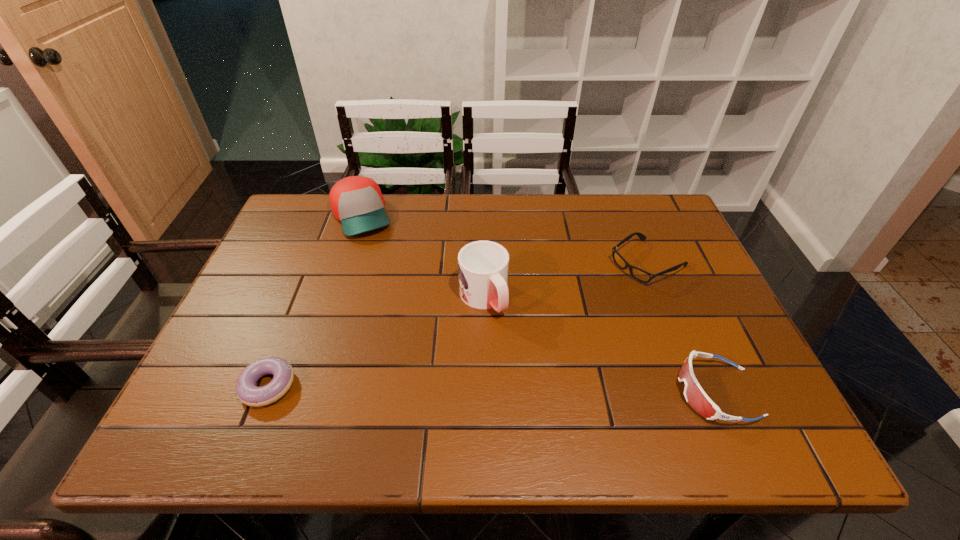
Locate an element on the screen. spectacles that is at the far edge is located at coordinates point(643,276).

Image resolution: width=960 pixels, height=540 pixels. I want to click on doughnut located in the near edge section of the desktop, so click(x=247, y=391).

Locate an element on the screen. The height and width of the screenshot is (540, 960). goggles located in the near edge section of the desktop is located at coordinates pyautogui.click(x=695, y=396).

Image resolution: width=960 pixels, height=540 pixels. Identify the location of doughnut located in the left edge section of the desktop. (247, 391).

Where is `baseball cap present at the left edge`? This screenshot has width=960, height=540. baseball cap present at the left edge is located at coordinates (356, 201).

Locate an element on the screen. goggles present at the right edge is located at coordinates (695, 396).

Identify the location of spectacles that is at the right edge. (643, 276).

Identify the location of object that is at the far left corner. (356, 201).

The height and width of the screenshot is (540, 960). I want to click on object that is at the near left corner, so click(247, 391).

Find the location of a particular element. The width and height of the screenshot is (960, 540). object positioned at the far right corner is located at coordinates (643, 276).